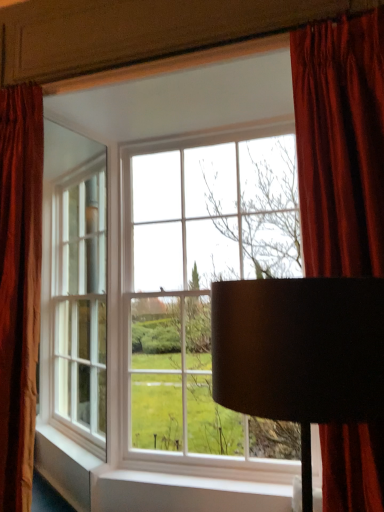
Question: In the image, is velvet red curtain at left, the 2th curtain in the right-to-left sequence, on the left side or the right side of velvet red curtain at upper right, marked as the 2th curtain in a left-to-right arrangement?

Choices:
 (A) left
 (B) right

Answer: (A)

Question: Considering their positions, is velvet red curtain at left, which is counted as the 1th curtain, starting from the left, located in front of or behind velvet red curtain at upper right, which is the first curtain from right to left?

Choices:
 (A) behind
 (B) front

Answer: (A)

Question: Based on their relative distances, which object is nearer to the black matte lampshade at center?

Choices:
 (A) velvet red curtain at left, the 2th curtain in the right-to-left sequence
 (B) velvet red curtain at upper right, which is the first curtain from right to left
 (C) matte glass window at center

Answer: (B)

Question: Which is nearer to the matte glass window at center?

Choices:
 (A) black matte lampshade at center
 (B) velvet red curtain at left, which is counted as the 1th curtain, starting from the left
 (C) velvet red curtain at upper right, which is the first curtain from right to left

Answer: (B)